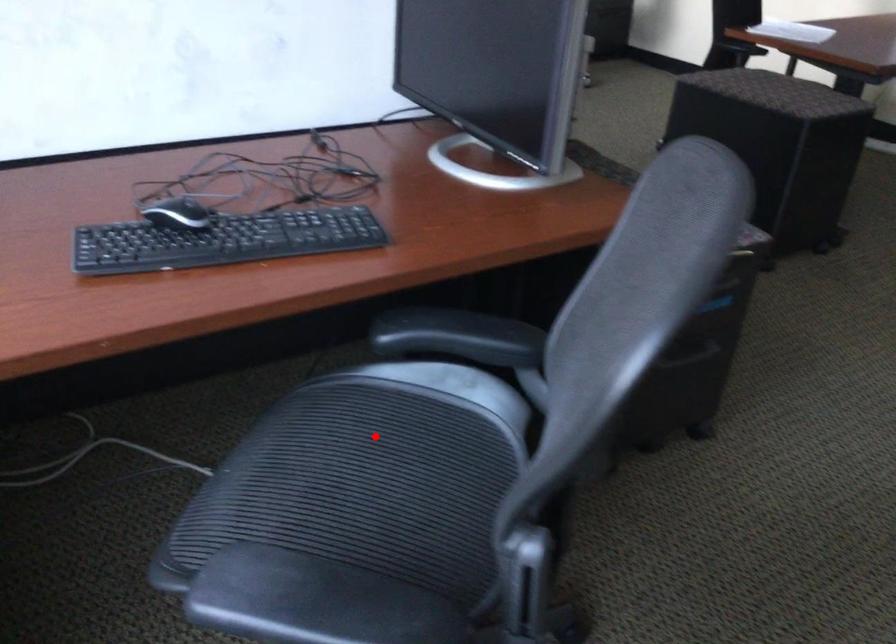
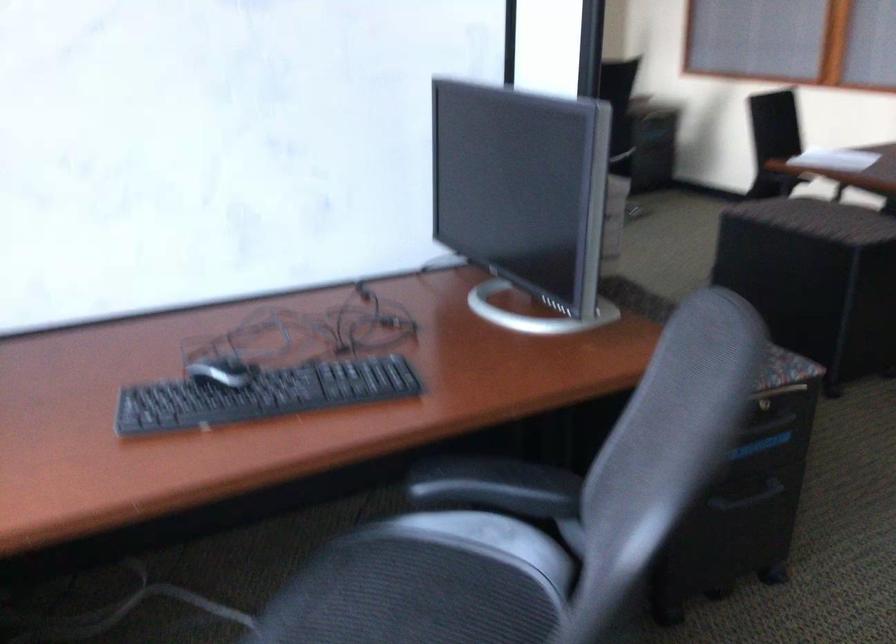
The point at the highlighted location is marked in the first image. Where is the corresponding point in the second image?

(410, 596)